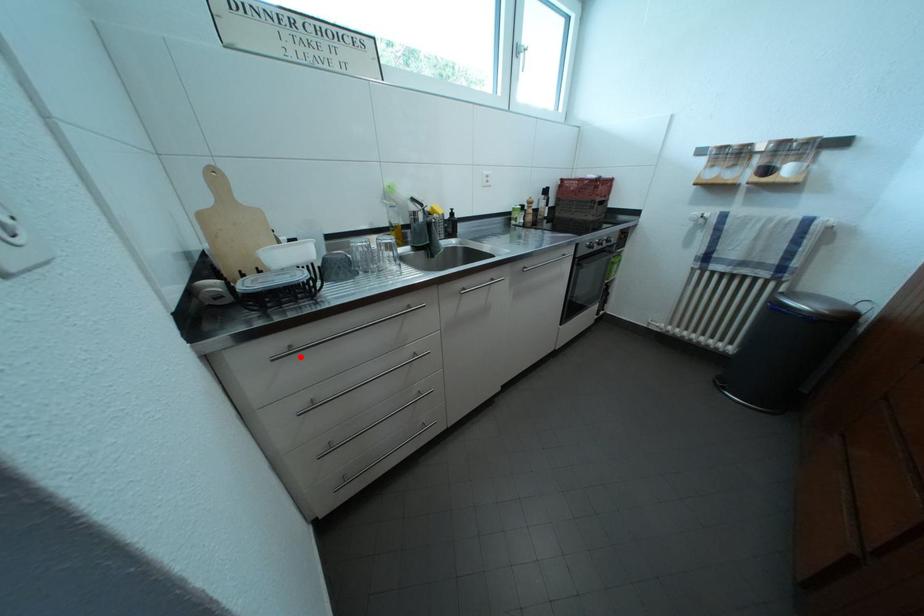
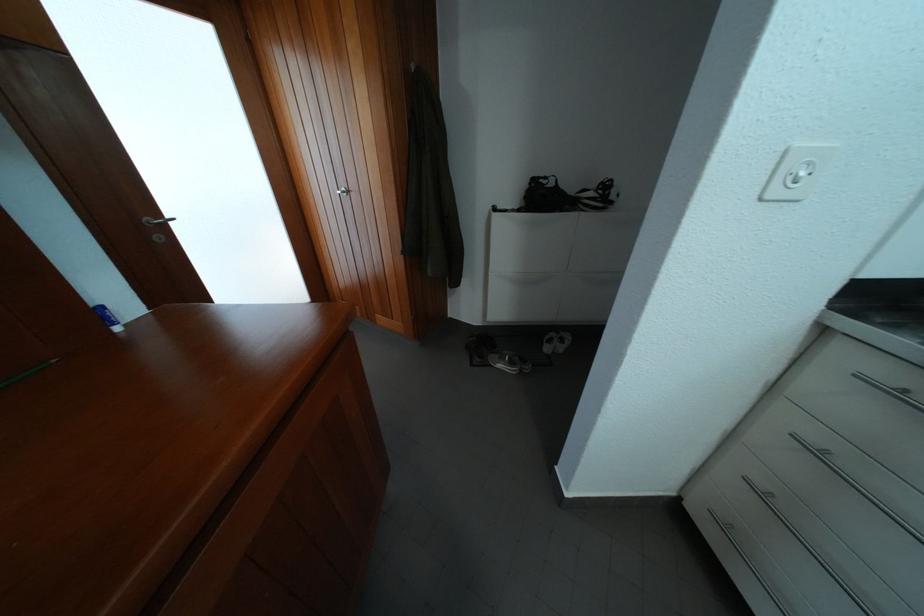
Question: I am providing you with two images of the same scene from different viewpoints. Image1 has a red point marked. In image2, the corresponding 3D location appears at what relative position? Reply with the corresponding letter.

Choices:
 (A) Closer
 (B) Farther

Answer: (B)